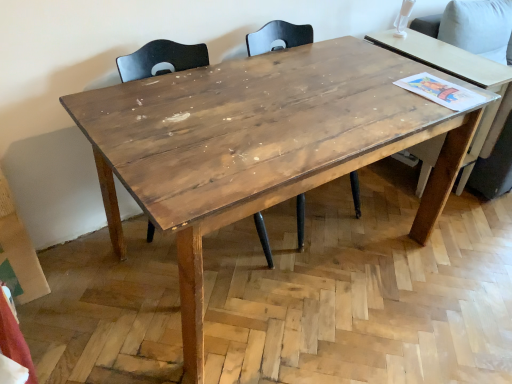
Question: From a real-world perspective, is wooden chair at center, arranged as the 1th chair when viewed from the left, on top of wooden chair at center, which is the first chair in right-to-left order?

Choices:
 (A) no
 (B) yes

Answer: (A)

Question: Is wooden chair at center, marked as the second chair in a left-to-right arrangement, at the back of wooden chair at center, which appears as the second chair when viewed from the right?

Choices:
 (A) yes
 (B) no

Answer: (B)

Question: Does wooden chair at center, which appears as the second chair when viewed from the right, appear on the right side of wooden chair at center, which is the first chair in right-to-left order?

Choices:
 (A) yes
 (B) no

Answer: (B)

Question: From the image's perspective, is wooden chair at center, which appears as the second chair when viewed from the right, below wooden chair at center, which is the first chair in right-to-left order?

Choices:
 (A) yes
 (B) no

Answer: (A)

Question: Considering the relative sizes of wooden chair at center, which appears as the second chair when viewed from the right, and wooden chair at center, marked as the second chair in a left-to-right arrangement, in the image provided, is wooden chair at center, which appears as the second chair when viewed from the right, taller than wooden chair at center, marked as the second chair in a left-to-right arrangement,?

Choices:
 (A) yes
 (B) no

Answer: (A)

Question: Is wooden chair at center, which appears as the second chair when viewed from the right, taller or shorter than wooden chair at center, marked as the second chair in a left-to-right arrangement?

Choices:
 (A) tall
 (B) short

Answer: (A)

Question: Is wooden chair at center, which appears as the second chair when viewed from the right, wider or thinner than wooden chair at center, which is the first chair in right-to-left order?

Choices:
 (A) wide
 (B) thin

Answer: (A)

Question: In the image, is wooden chair at center, arranged as the 1th chair when viewed from the left, on the left side or the right side of wooden chair at center, marked as the second chair in a left-to-right arrangement?

Choices:
 (A) right
 (B) left

Answer: (B)

Question: From a real-world perspective, is wooden chair at center, which appears as the second chair when viewed from the right, positioned above or below wooden chair at center, marked as the second chair in a left-to-right arrangement?

Choices:
 (A) above
 (B) below

Answer: (B)

Question: From a real-world perspective, is wooden chair at center, marked as the second chair in a left-to-right arrangement, above or below wooden table at right?

Choices:
 (A) above
 (B) below

Answer: (B)

Question: Is wooden chair at center, marked as the second chair in a left-to-right arrangement, taller or shorter than wooden table at right?

Choices:
 (A) short
 (B) tall

Answer: (A)

Question: Is wooden chair at center, which is the first chair in right-to-left order, inside the boundaries of wooden table at right, or outside?

Choices:
 (A) outside
 (B) inside

Answer: (A)

Question: From the image's perspective, is wooden chair at center, which is the first chair in right-to-left order, located above or below wooden table at right?

Choices:
 (A) below
 (B) above

Answer: (A)

Question: From a real-world perspective, relative to wooden chair at center, which appears as the second chair when viewed from the right, is wooden table at right vertically above or below?

Choices:
 (A) below
 (B) above

Answer: (B)

Question: Considering their positions, is wooden table at right located in front of or behind wooden chair at center, arranged as the 1th chair when viewed from the left?

Choices:
 (A) front
 (B) behind

Answer: (B)